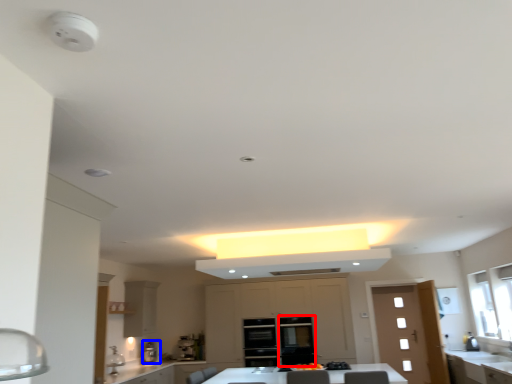
Question: Which object is further to the camera taking this photo, glass door (highlighted by a red box) or coffee machine (highlighted by a blue box)?

Choices:
 (A) glass door
 (B) coffee machine

Answer: (B)